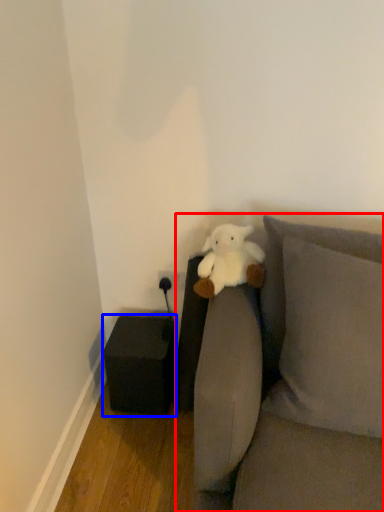
Question: Which object is closer to the camera taking this photo, studio couch (highlighted by a red box) or furniture (highlighted by a blue box)?

Choices:
 (A) studio couch
 (B) furniture

Answer: (A)